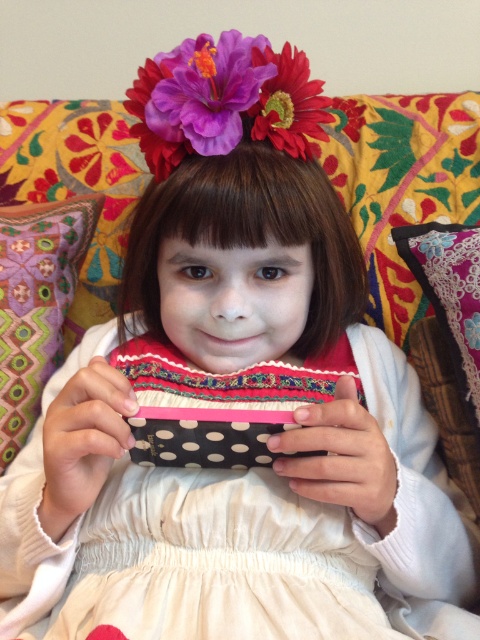
Question: Estimate the real-world distances between objects in this image. Which object is farther from the purple fabric flower at upper center?

Choices:
 (A) multicolored fabric pillow at lower left
 (B) floral fabric pillow at upper right

Answer: (A)

Question: Does floral fabric pillow at upper right appear on the left side of vibrant matte flower at center?

Choices:
 (A) no
 (B) yes

Answer: (A)

Question: Which point is farther to the camera?

Choices:
 (A) vibrant matte flower at center
 (B) white satin dress at center
 (C) purple fabric flower at upper center
 (D) multicolored fabric pillow at lower left

Answer: (D)

Question: Is white satin dress at center to the left of floral fabric pillow at upper right from the viewer's perspective?

Choices:
 (A) yes
 (B) no

Answer: (A)

Question: Estimate the real-world distances between objects in this image. Which object is farther from the purple fabric flower at upper center?

Choices:
 (A) floral fabric pillow at upper right
 (B) vibrant matte flower at center

Answer: (A)

Question: Can you confirm if purple fabric flower at upper center is smaller than vibrant matte flower at center?

Choices:
 (A) no
 (B) yes

Answer: (A)